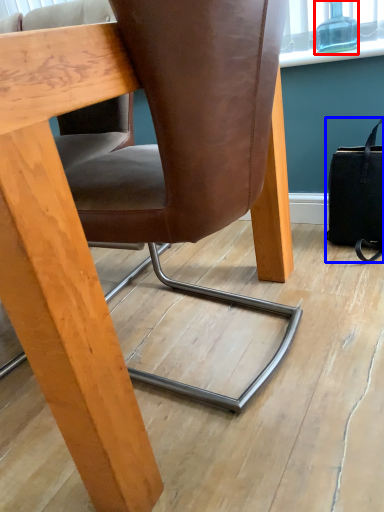
Question: Which object is closer to the camera taking this photo, bottle (highlighted by a red box) or handbag (highlighted by a blue box)?

Choices:
 (A) bottle
 (B) handbag

Answer: (B)